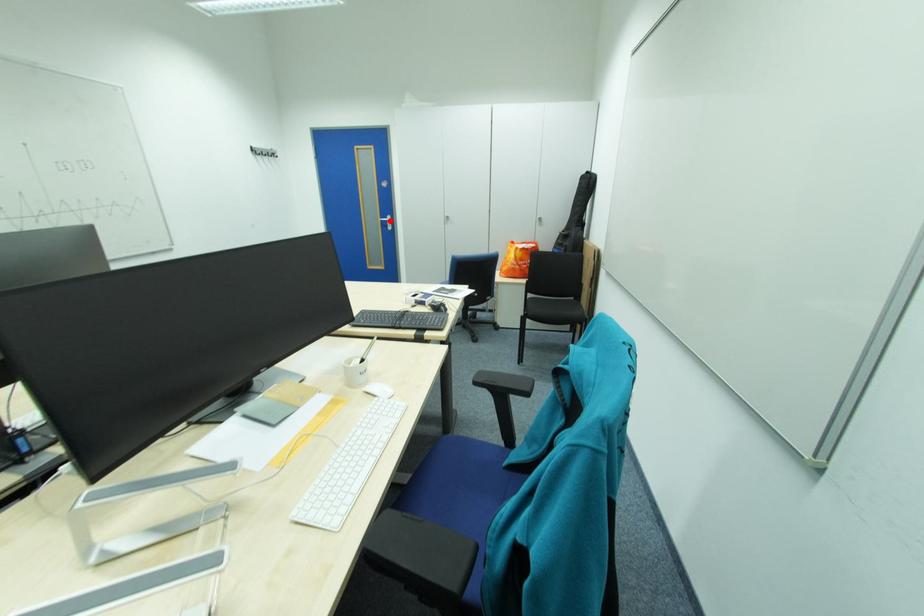
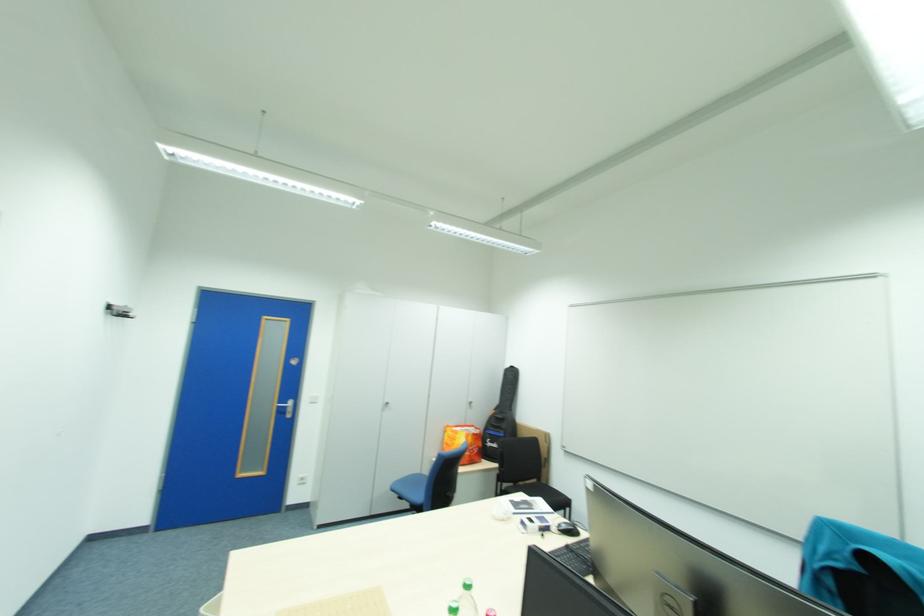
Question: I am providing you with two images of the same scene from different viewpoints. Given a red point in image1, look at the same physical point in image2. Is it:

Choices:
 (A) Closer to the viewpoint
 (B) Farther from the viewpoint

Answer: (B)